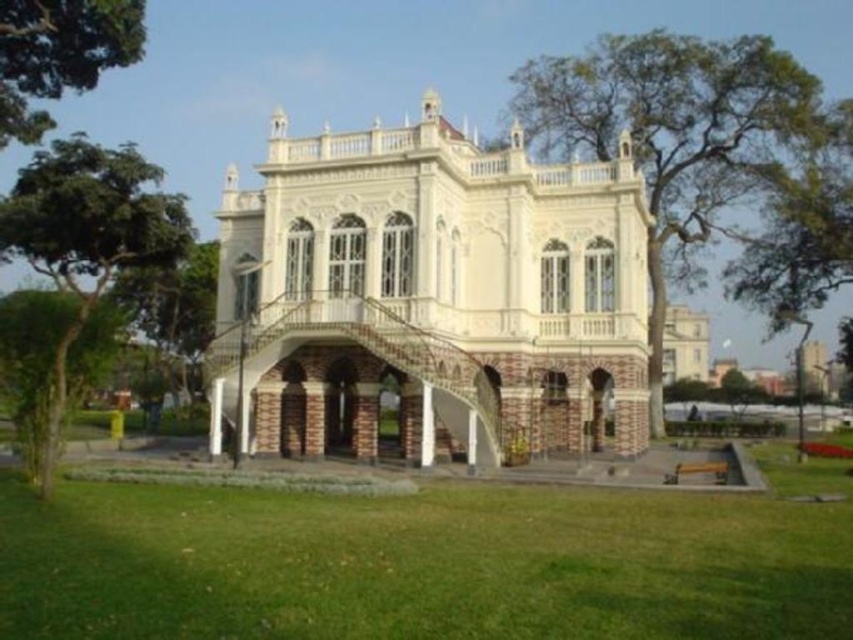
Find the location of `green leafy tree at upper center`. green leafy tree at upper center is located at coordinates (693, 148).

Can you confirm if green leafy tree at upper center is positioned to the left of green leafy tree at upper left?

No, green leafy tree at upper center is not to the left of green leafy tree at upper left.

I want to click on green leafy tree at upper center, so coord(693,148).

Between point (102, 148) and point (51, 49), which one is positioned behind?

Point (102, 148)

Locate an element on the screen. green leafy tree at left is located at coordinates (86, 236).

Between green leafy tree at upper center and green leafy tree at left, which one appears on the left side from the viewer's perspective?

Positioned to the left is green leafy tree at left.

Is point (610, 80) in front of point (117, 172)?

No, it is not.

Locate an element on the screen. The width and height of the screenshot is (853, 640). green leafy tree at upper center is located at coordinates (693, 148).